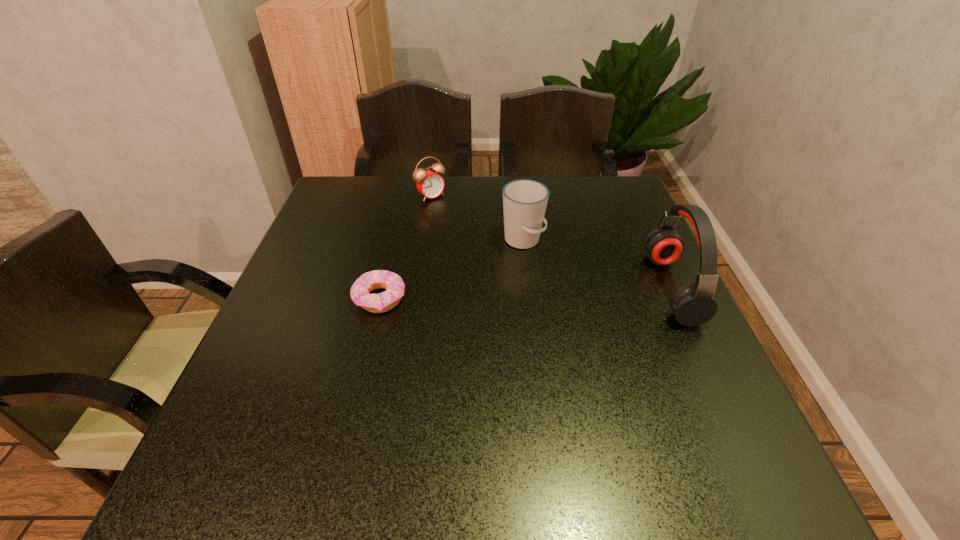
The image size is (960, 540). Find the location of `free space located 0.150m on the clock face of the third tallest object`. free space located 0.150m on the clock face of the third tallest object is located at coordinates (466, 226).

I want to click on free point located 0.310m with a handle on the side of the second object from right to left, so click(609, 341).

Locate an element on the screen. The height and width of the screenshot is (540, 960). vacant space located with a handle on the side of the second object from right to left is located at coordinates (589, 319).

What are the coordinates of `vacant area situated with a handle on the side of the second object from right to left` in the screenshot? It's located at (584, 312).

At what (x,y) coordinates should I click in order to perform the action: click on object situated at the far edge. Please return your answer as a coordinate pair (x, y). The width and height of the screenshot is (960, 540). Looking at the image, I should click on (430, 184).

Image resolution: width=960 pixels, height=540 pixels. Identify the location of object that is at the right edge. (692, 304).

In the image, there is a desktop. Find the location of `vacant space at the far edge`. vacant space at the far edge is located at coordinates (577, 201).

In order to click on free space at the left edge of the desktop in this screenshot , I will do `click(344, 249)`.

The image size is (960, 540). In the image, there is a desktop. Find the location of `free space at the right edge`. free space at the right edge is located at coordinates (635, 341).

The height and width of the screenshot is (540, 960). In the image, there is a desktop. In order to click on blank space at the far left corner in this screenshot , I will do click(333, 200).